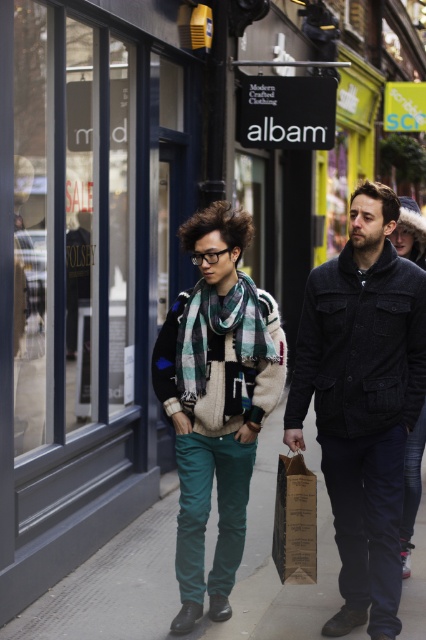
Question: Can you confirm if dark woolen jacket at center is bigger than green plaid scarf at center?

Choices:
 (A) no
 (B) yes

Answer: (B)

Question: Based on their relative distances, which object is nearer to the teal fabric pants at lower center?

Choices:
 (A) green plaid scarf at center
 (B) brown paper bag at center

Answer: (B)

Question: Which of the following is the farthest from the observer?

Choices:
 (A) (342, 476)
 (B) (301, 464)
 (C) (247, 284)
 (D) (275, 442)

Answer: (D)

Question: Can you confirm if dark woolen jacket at center is positioned to the left of green plaid scarf at center?

Choices:
 (A) yes
 (B) no

Answer: (B)

Question: Which point is farther to the camera?

Choices:
 (A) (313, 547)
 (B) (328, 356)

Answer: (B)

Question: In this image, where is dark woolen jacket at center located relative to brown paper bag at center?

Choices:
 (A) above
 (B) below

Answer: (A)